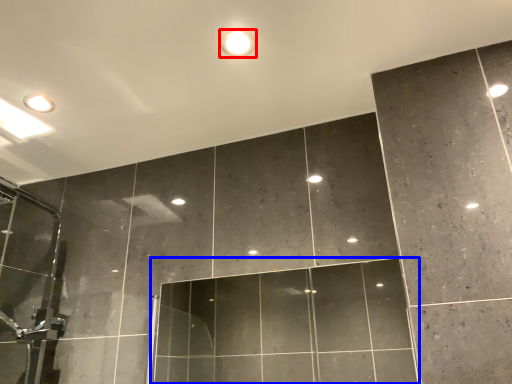
Question: Which object appears closest to the camera in this image, droplight (highlighted by a red box) or glass door (highlighted by a blue box)?

Choices:
 (A) droplight
 (B) glass door

Answer: (B)